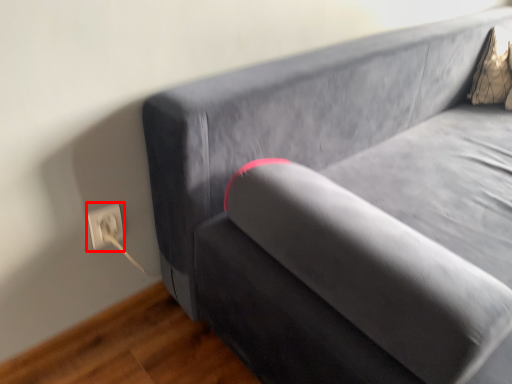
Question: In this image, where is electric outlet (annotated by the red box) located relative to pillow?

Choices:
 (A) left
 (B) right

Answer: (A)